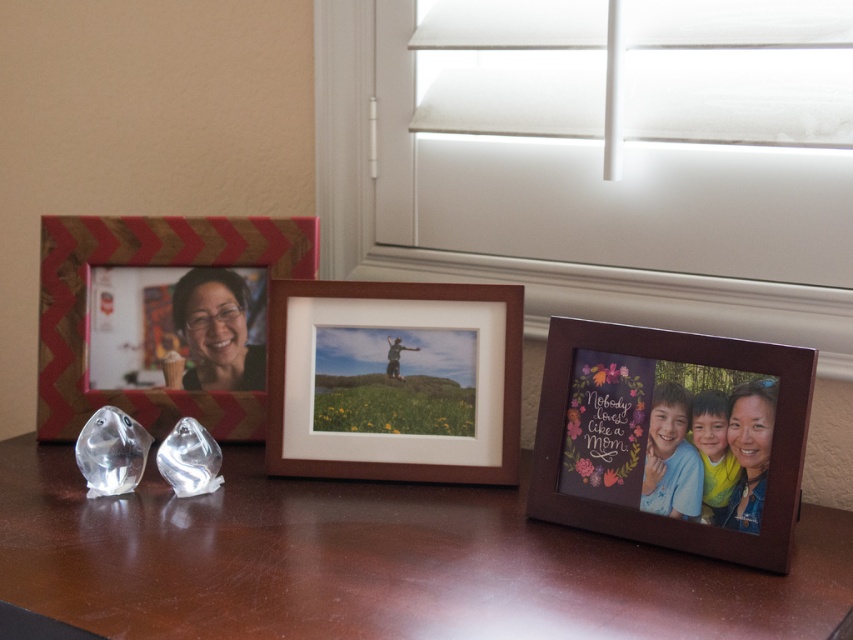
Question: Which of the following is the closest to the observer?

Choices:
 (A) (462, 448)
 (B) (674, 422)
 (C) (415, 557)
 (D) (543, 408)

Answer: (C)

Question: Which point is closer to the camera?

Choices:
 (A) (556, 321)
 (B) (253, 504)
 (C) (134, 232)

Answer: (A)

Question: Observing the image, what is the correct spatial positioning of brown matte photo frame at center in reference to chevron-patterned wood frame at left?

Choices:
 (A) left
 (B) right

Answer: (B)

Question: Which object appears closest to the camera in this image?

Choices:
 (A) brown wooden table at center
 (B) matte wooden photo frame at lower right

Answer: (A)

Question: Can you confirm if chevron-patterned wood frame at left is positioned below matte wooden photo frame at lower right?

Choices:
 (A) yes
 (B) no

Answer: (B)

Question: Is brown wooden table at center closer to the viewer compared to brown matte photo frame at center?

Choices:
 (A) no
 (B) yes

Answer: (B)